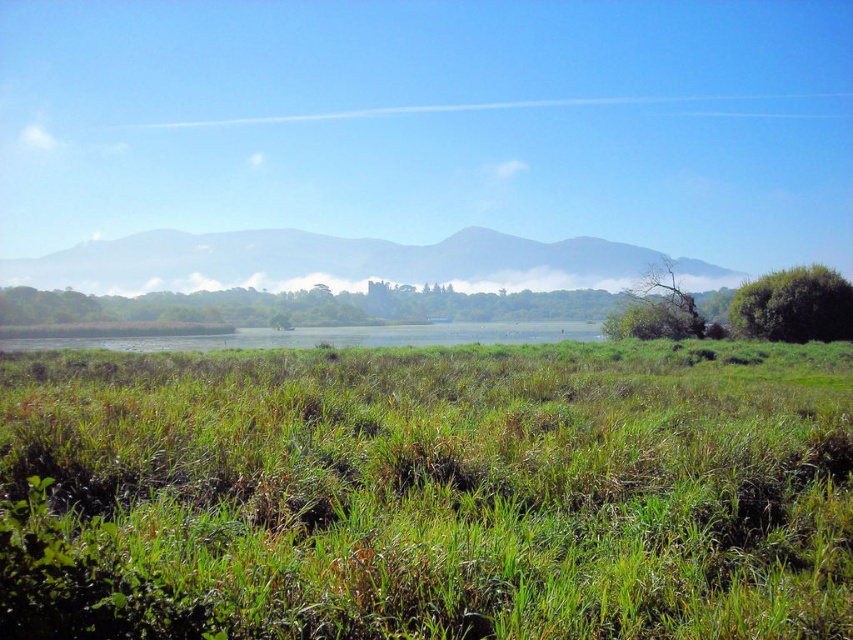
You are planning to set up a tent in the scene. The tent requires a space that is wider than the green leafy tree at right. Can the green grassy hill at center provide enough width for the tent?

The green grassy hill at center has a width larger than the green leafy tree at right, so yes, the green grassy hill at center can provide enough width for the tent.

You are standing on the edge of the water and see the green grassy field at center and the green leafy bush at right. Which object is closer to you?

The green grassy field at center is closer to you because it is located below the green leafy bush at right, indicating it is in a lower position relative to the observer.

You are standing at the edge of the water and want to walk to the green leafy bush at right. There is a green grassy hill at center in your path. Can you walk directly to the bush without going around the hill?

The green grassy hill at center is 22.99 meters away from the green leafy bush at right. Since the hill is between you and the bush, you would need to go around it to reach the bush.